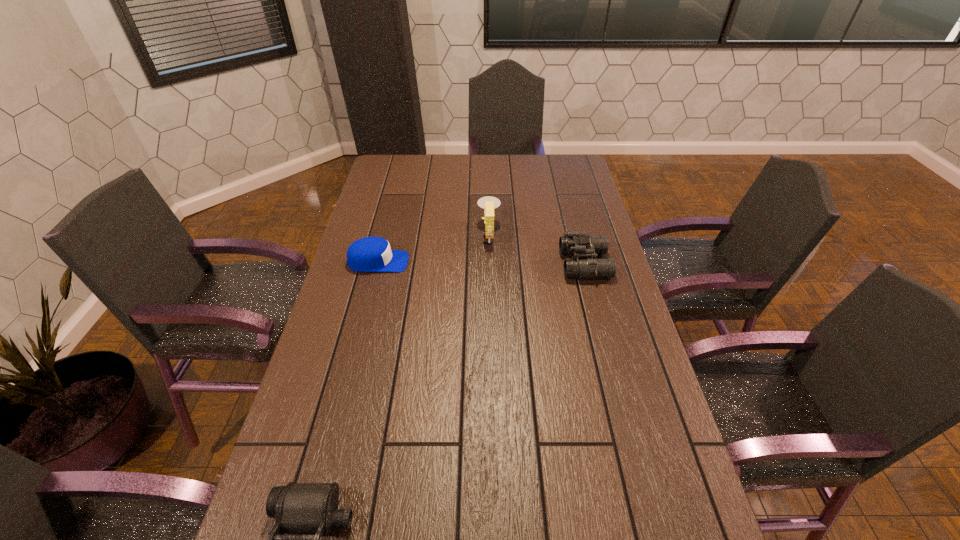
Locate an element on the screen. The image size is (960, 540). the third object from left to right is located at coordinates coord(489,203).

In order to click on sponge in this screenshot , I will do `click(489, 203)`.

This screenshot has height=540, width=960. I want to click on the taller binoculars, so 576,243.

You are a GUI agent. You are given a task and a screenshot of the screen. Output one action in this format:
    pyautogui.click(x=<x>, y=<y>)
    Task: Click on the right binoculars
    This screenshot has width=960, height=540.
    Given the screenshot: What is the action you would take?
    click(576, 243)

Identify the location of baseball cap. The image size is (960, 540). (369, 254).

Where is `vacant area situated 0.130m on the front-facing side of the third object from left to right`? vacant area situated 0.130m on the front-facing side of the third object from left to right is located at coordinates (442, 235).

Identify the location of vacant area situated on the front-facing side of the third object from left to right. (424, 235).

Where is `vacant area located on the front-facing side of the third object from left to right`? Image resolution: width=960 pixels, height=540 pixels. vacant area located on the front-facing side of the third object from left to right is located at coordinates (449, 235).

Where is `vacant space positioned 0.080m through the lenses of the taller binoculars`? This screenshot has width=960, height=540. vacant space positioned 0.080m through the lenses of the taller binoculars is located at coordinates (538, 264).

Locate an element on the screen. The width and height of the screenshot is (960, 540). free space located 0.400m through the lenses of the taller binoculars is located at coordinates (442, 264).